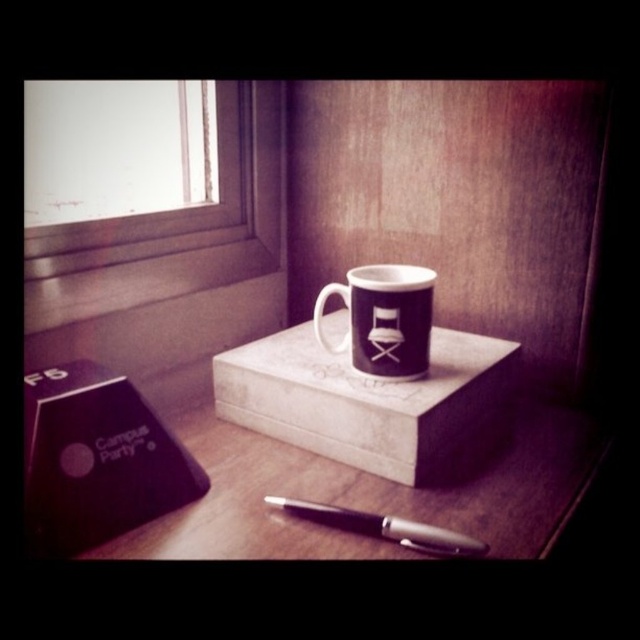
You are organizing items on a desk and have a matte white box at center and a purple matte mug at upper center. If you need to place a new item between them, which item requires more horizontal space due to its width?

The matte white box at center requires more horizontal space because its width surpasses that of the purple matte mug at upper center.

In the scene shown: You are a barista who needs to place a new coffee cup that is 3 inches in diameter on the matte wooden table at center. Can the purple matte mug at upper center be moved to make space without exceeding the table edges?

The distance between the matte wooden table at center and the purple matte mug at upper center is 6.73 inches, so moving the purple matte mug at upper center by 3 inches would still leave 3.73 inches of space. This suggests there is enough space to move the mug and place the new coffee cup without going beyond the table edges.

You are organizing a desk and need to place the black metallic pen at lower center and the purple matte mug at upper center. Based on their positions, which object is closer to you?

The purple matte mug at upper center is closer to you because the black metallic pen at lower center is behind it.